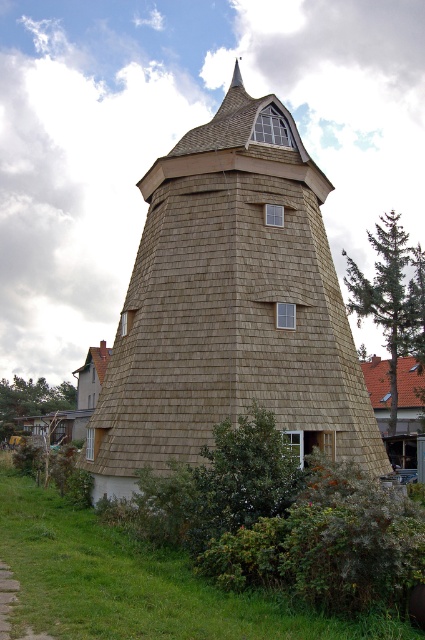
You are standing in front of the windmill and want to know the relative position of the wooden shingle tower at center and the brown shingles at upper right. Which one is higher up?

The wooden shingle tower at center is above the brown shingles at upper right, so it is higher up.

You are standing at the center of the grassy area around the windmill. You want to locate the wooden shingle tower at center. Which direction should you look?

The wooden shingle tower at center is located at point coordinates (231, 305), so you should look towards the center of the image to find it.